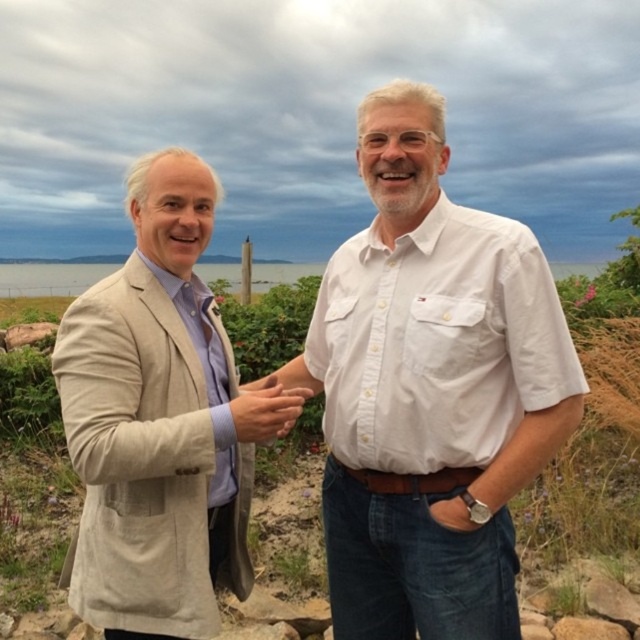
Question: Does transparent water at center have a greater width compared to matte beige hand at center?

Choices:
 (A) no
 (B) yes

Answer: (B)

Question: Which point is closer to the camera?

Choices:
 (A) (396, 433)
 (B) (296, 396)
 (C) (140, 529)

Answer: (C)

Question: Among these points, which one is farthest from the camera?

Choices:
 (A) (252, 410)
 (B) (372, 612)

Answer: (B)

Question: Which point appears farthest from the camera in this image?

Choices:
 (A) (42, 264)
 (B) (289, 422)
 (C) (426, 296)

Answer: (A)

Question: Can you confirm if beige linen suit at left is thinner than transparent water at center?

Choices:
 (A) no
 (B) yes

Answer: (B)

Question: Is beige linen suit at left bigger than transparent water at center?

Choices:
 (A) yes
 (B) no

Answer: (B)